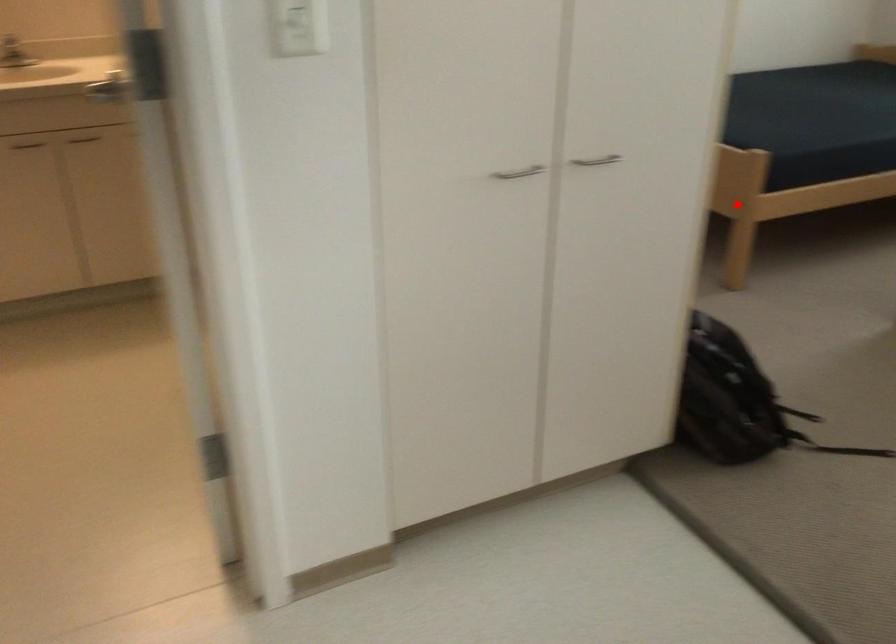
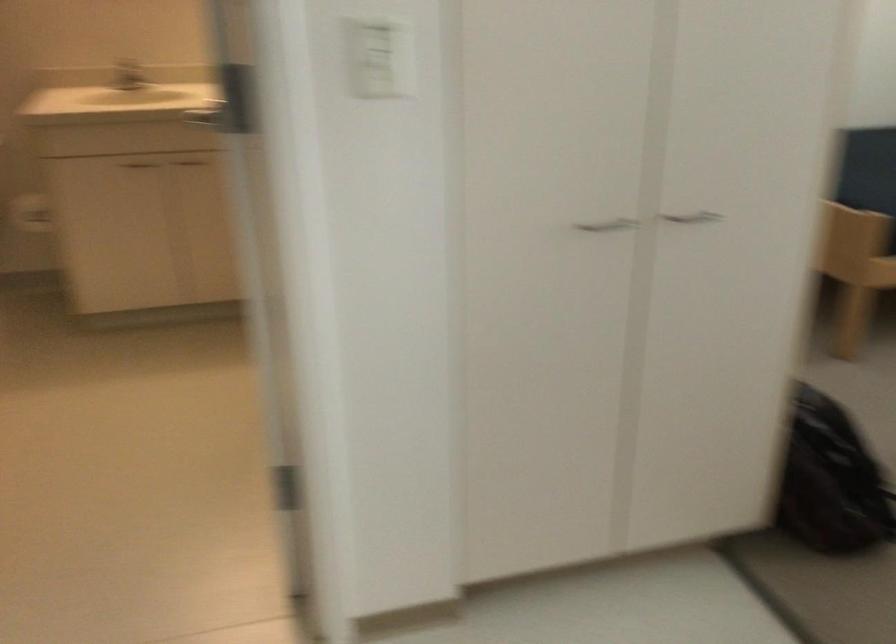
In the second image, find the point that corresponds to the highlighted location in the first image.

(855, 269)